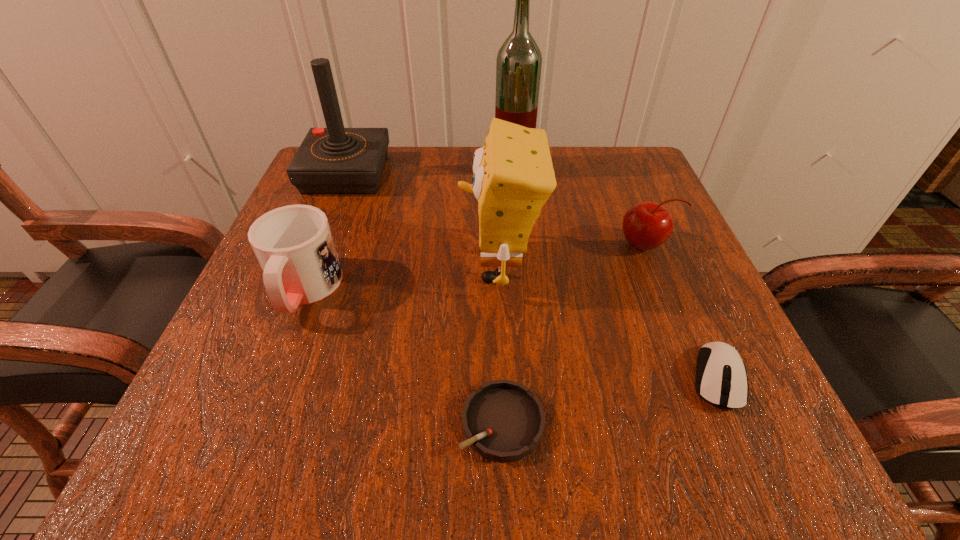
What are the coordinates of `liquor` in the screenshot? It's located at (518, 66).

Locate an element on the screen. joystick is located at coordinates (335, 160).

The image size is (960, 540). I want to click on sponge, so click(513, 177).

Locate an element on the screen. This screenshot has height=540, width=960. mug is located at coordinates (294, 245).

This screenshot has height=540, width=960. I want to click on cherry, so click(646, 225).

Where is `mouse`? The width and height of the screenshot is (960, 540). mouse is located at coordinates [x=721, y=379].

Where is `ashtray`? ashtray is located at coordinates (503, 421).

The image size is (960, 540). Find the location of `free space located 0.180m on the front of the liquor`. free space located 0.180m on the front of the liquor is located at coordinates point(519,231).

Identify the location of vacant area situated on the rectangular base of the joystick. The image size is (960, 540). (313, 258).

I want to click on free space located on the face of the sponge, so click(x=382, y=266).